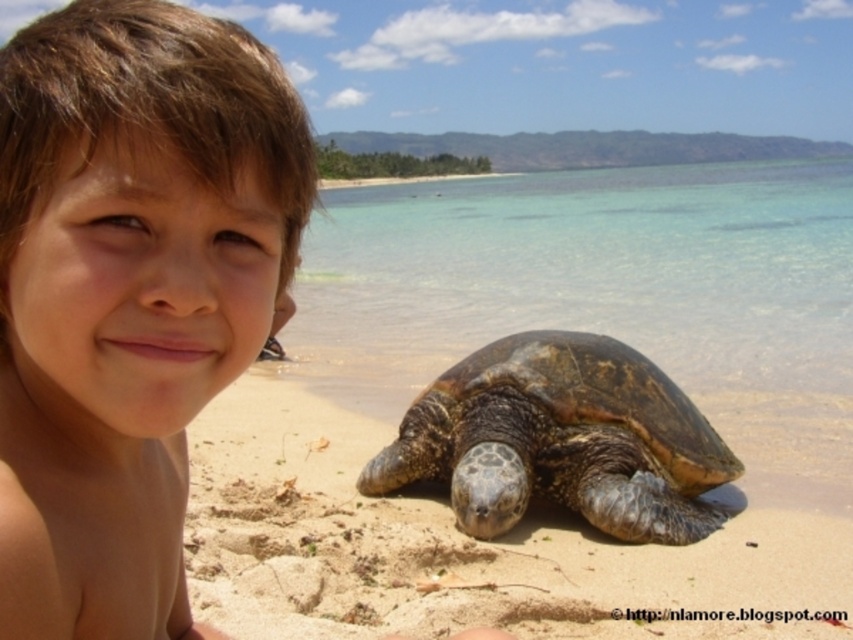
Question: Does brown sandy beach at lower center have a lesser width compared to dark brown textured tortoise at lower center?

Choices:
 (A) yes
 (B) no

Answer: (B)

Question: From the image, what is the correct spatial relationship of brown sandy beach at lower center in relation to dark brown textured tortoise at lower center?

Choices:
 (A) right
 (B) left

Answer: (B)

Question: Which point is closer to the camera taking this photo?

Choices:
 (A) (544, 493)
 (B) (387, 586)

Answer: (B)

Question: Which point is closer to the camera taking this photo?

Choices:
 (A) (155, 141)
 (B) (631, 497)
 (C) (318, 568)

Answer: (A)

Question: Is smooth skin child at center closer to the viewer compared to brown sandy beach at lower center?

Choices:
 (A) yes
 (B) no

Answer: (A)

Question: Which point is farther from the camera taking this photo?

Choices:
 (A) tap(833, 536)
 (B) tap(50, 435)

Answer: (A)